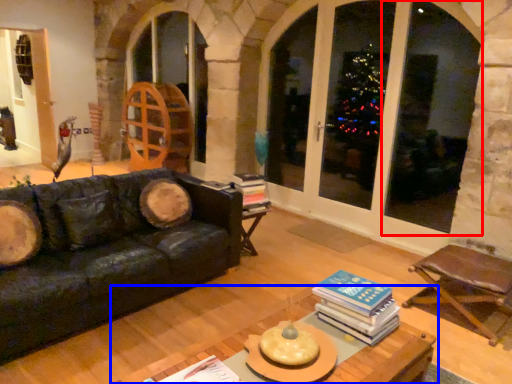
Question: Which of the following is the farthest to the observer, window (highlighted by a red box) or table (highlighted by a blue box)?

Choices:
 (A) window
 (B) table

Answer: (A)